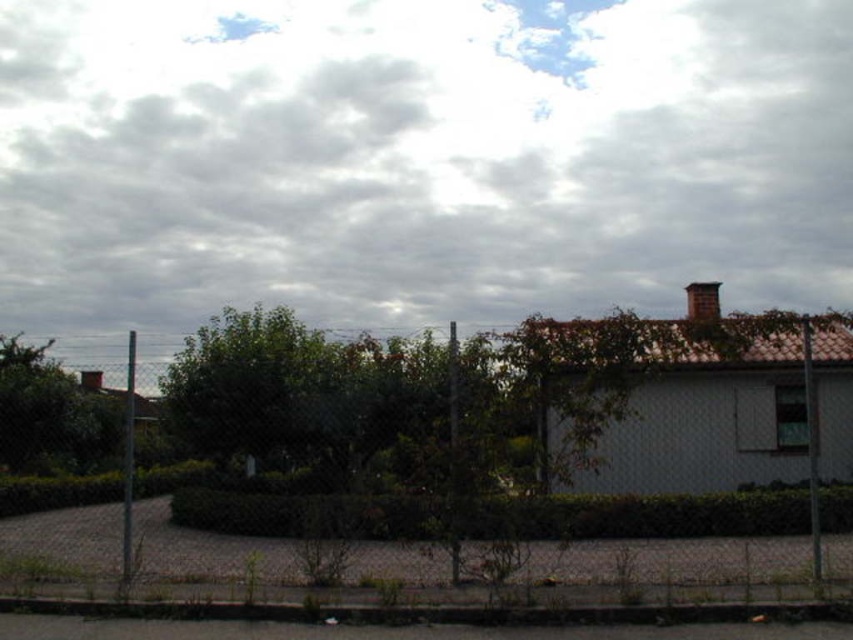
Question: Can you confirm if chain-link fence at center is positioned to the right of brown clay chimney at upper center?

Choices:
 (A) yes
 (B) no

Answer: (B)

Question: Estimate the real-world distances between objects in this image. Which object is closer to the brown clay chimney at upper center?

Choices:
 (A) cloudy sky at upper center
 (B) chain-link fence at center

Answer: (B)

Question: From the image, what is the correct spatial relationship of cloudy sky at upper center in relation to chain-link fence at center?

Choices:
 (A) below
 (B) above

Answer: (B)

Question: Estimate the real-world distances between objects in this image. Which object is farther from the chain-link fence at center?

Choices:
 (A) cloudy sky at upper center
 (B) brown clay chimney at upper center

Answer: (A)

Question: Is chain-link fence at center positioned behind brown clay chimney at upper center?

Choices:
 (A) no
 (B) yes

Answer: (A)

Question: Which object appears farthest from the camera in this image?

Choices:
 (A) chain-link fence at center
 (B) cloudy sky at upper center

Answer: (B)